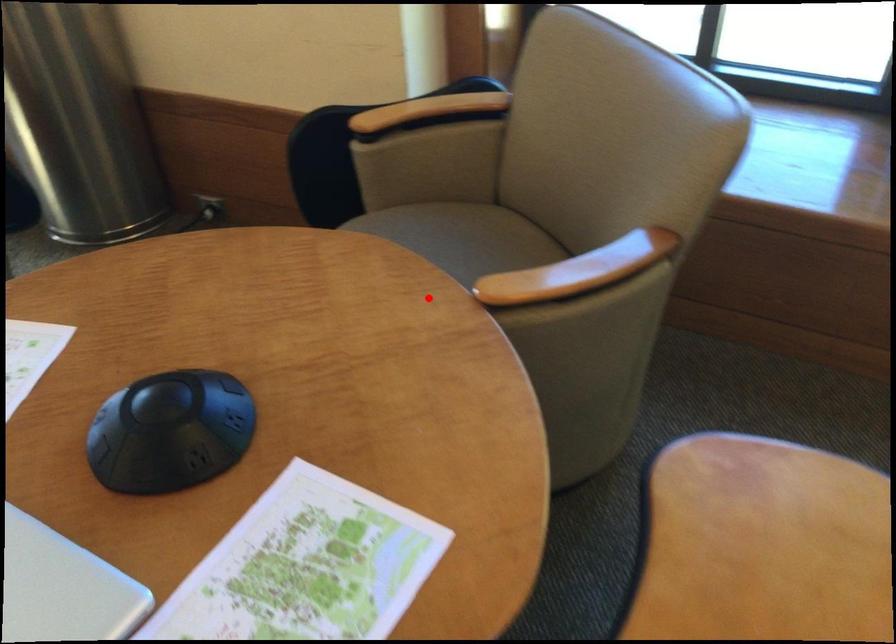
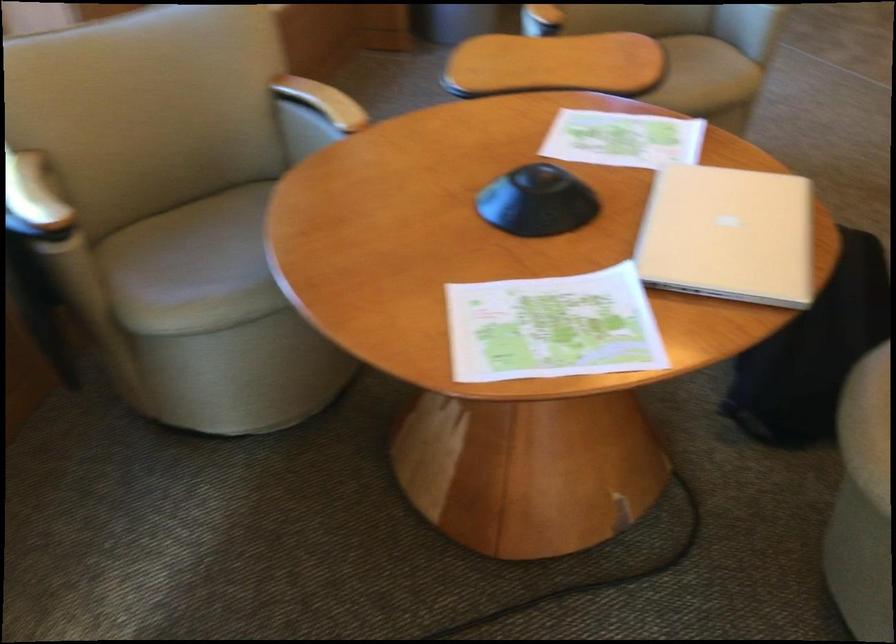
Where in the second image is the point corresponding to the highlighted location from the first image?

(193, 267)